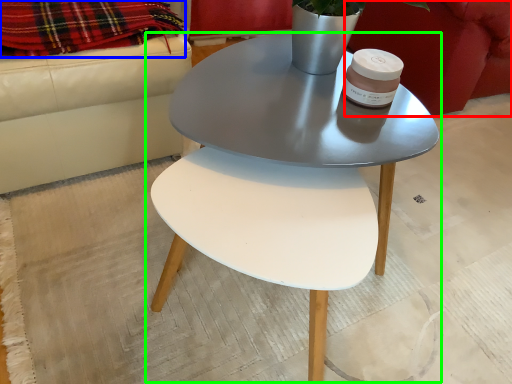
Question: Considering the real-world distances, which object is closest to armchair (highlighted by a red box)? blanket (highlighted by a blue box) or coffee table (highlighted by a green box).

Choices:
 (A) blanket
 (B) coffee table

Answer: (B)